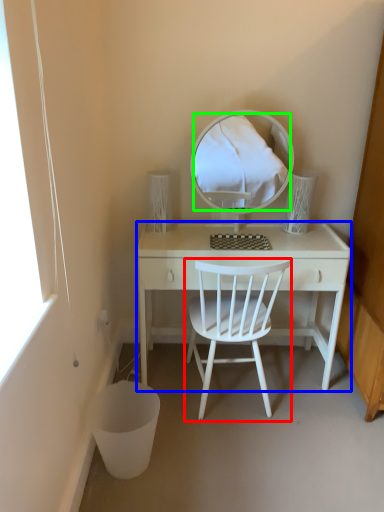
Question: Which object is the farthest from chair (highlighted by a red box)? Choose among these: desk (highlighted by a blue box) or mirror (highlighted by a green box).

Choices:
 (A) desk
 (B) mirror

Answer: (B)